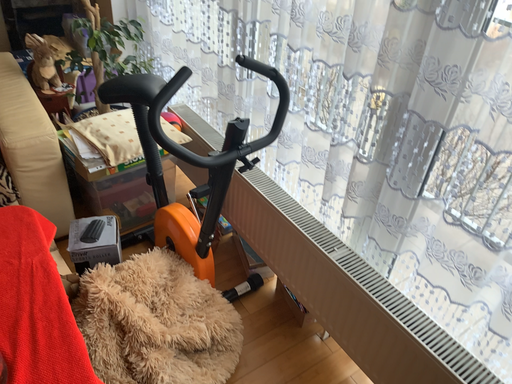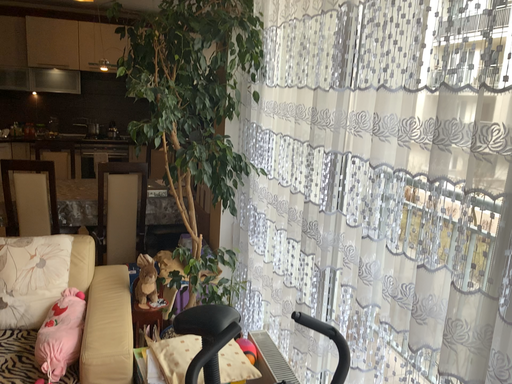
Question: Which way did the camera rotate in the video?

Choices:
 (A) rotated downward
 (B) rotated upward

Answer: (B)